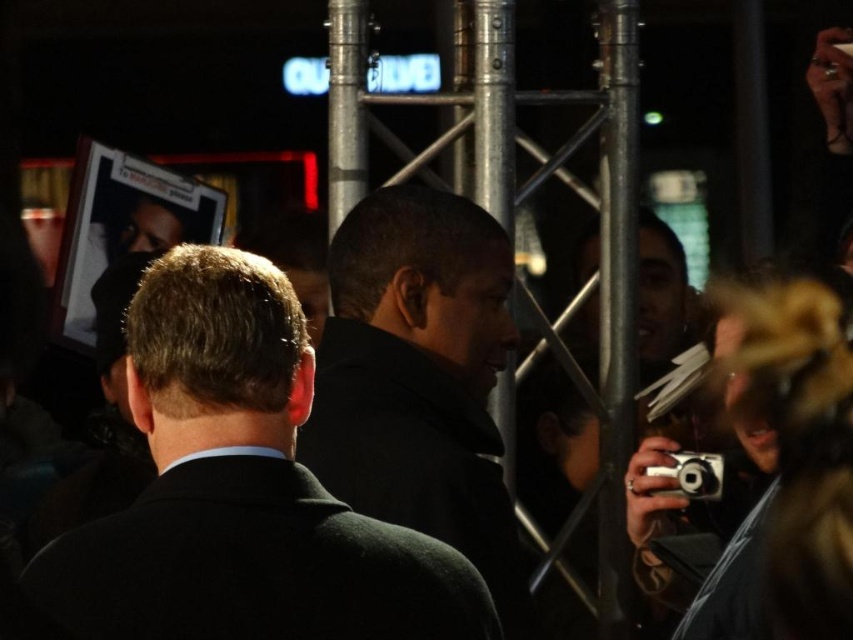
You are standing at the point labeled point (447, 227) and want to move to the point labeled point (706, 492). Given that you can only move forward in a straight line, will you be able to reach the second point without changing direction?

Since point (447, 227) is closer to the viewer than point (706, 492), moving forward in a straight line from point (447, 227) would take you away from point (706, 492). Therefore, you cannot reach the second point without changing direction.

Consider the image. You are a photographer at the event and need to capture a clear shot of the black woolen suit at center without the silver metallic camera at lower right blocking the view. Based on their sizes, can you position yourself so that the camera doesn

The black woolen suit at center is much taller than the silver metallic camera at lower right. Therefore, positioning yourself at a lower angle would allow the silver metallic camera at lower right to be hidden behind the taller black woolen suit at center, ensuring a clear view of the suit.